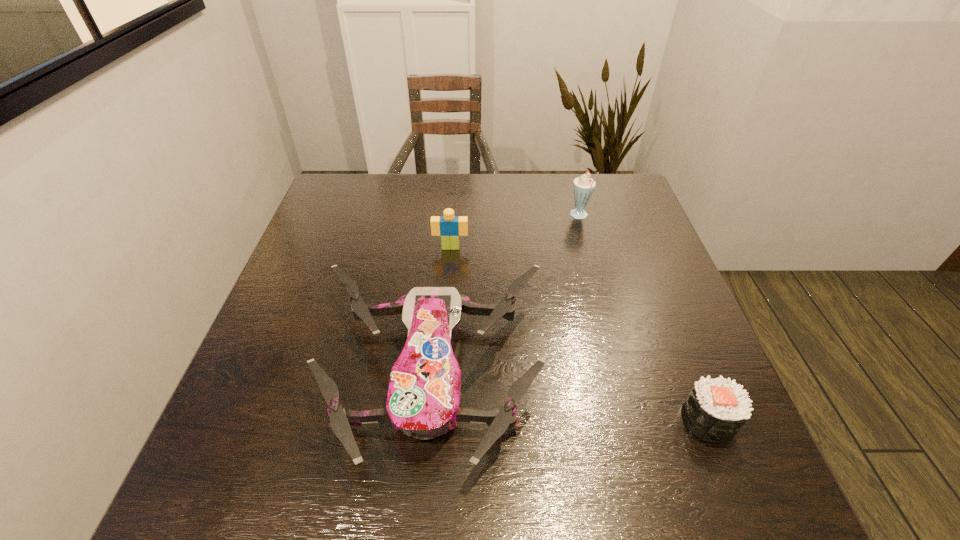
What are the coordinates of `milkshake` in the screenshot? It's located at (584, 185).

Locate an element on the screen. the second object from right to left is located at coordinates (584, 185).

The width and height of the screenshot is (960, 540). In order to click on the third nearest object in this screenshot , I will do `click(450, 227)`.

Identify the location of drone. Image resolution: width=960 pixels, height=540 pixels. (423, 399).

Find the location of a particular element. The image size is (960, 540). the shortest object is located at coordinates (716, 409).

Where is `sushi`? The height and width of the screenshot is (540, 960). sushi is located at coordinates (716, 409).

Where is `free space located 0.060m on the straw side of the second object from right to left`? This screenshot has height=540, width=960. free space located 0.060m on the straw side of the second object from right to left is located at coordinates (548, 216).

Find the location of a particular element. vacant space positioned 0.400m on the straw side of the second object from right to left is located at coordinates (431, 216).

I want to click on vacant space situated 0.280m on the straw side of the second object from right to left, so click(x=472, y=216).

Locate an element on the screen. Image resolution: width=960 pixels, height=540 pixels. vacant space located on the face of the Lego is located at coordinates (444, 334).